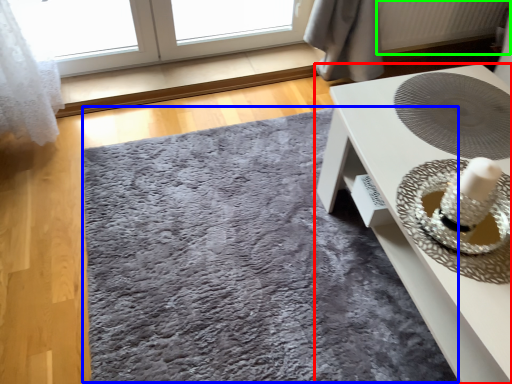
Question: Which object is positioned farthest from table (highlighted by a red box)? Select from mat (highlighted by a blue box) and radiator (highlighted by a green box).

Choices:
 (A) mat
 (B) radiator

Answer: (B)